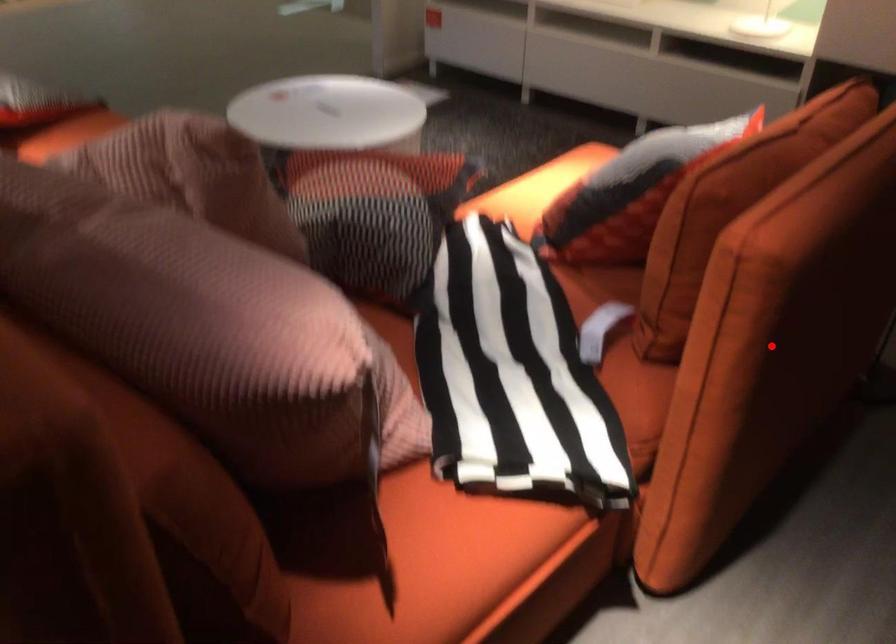
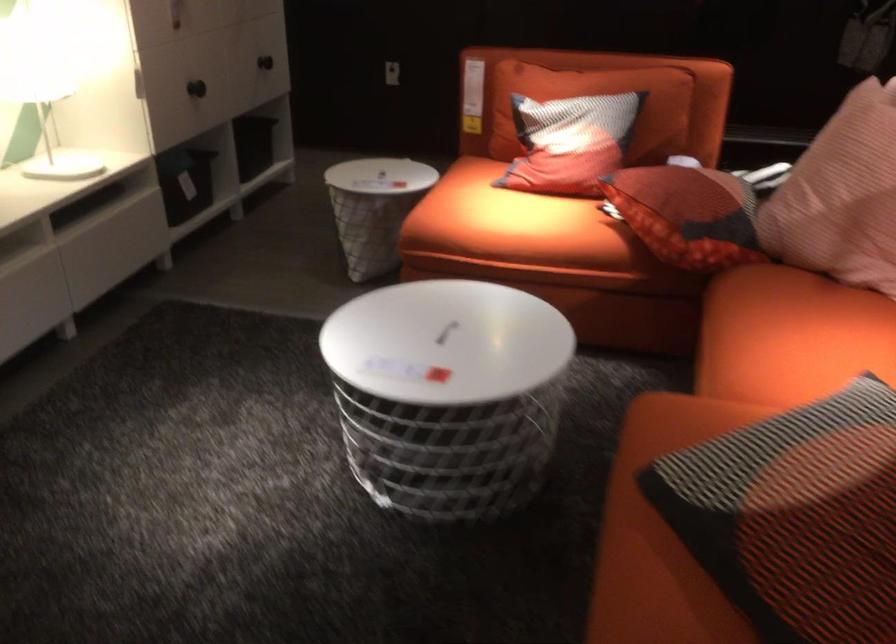
Question: I am providing you with two images of the same scene from different viewpoints. A red point is marked on the first image. Is the red point's position out of view in image 2?

Choices:
 (A) Yes
 (B) No

Answer: (A)